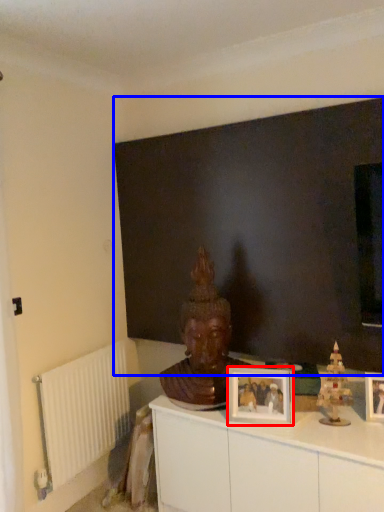
Question: Which point is closer to the camera, picture frame (highlighted by a red box) or backdrop (highlighted by a blue box)?

Choices:
 (A) picture frame
 (B) backdrop

Answer: (B)